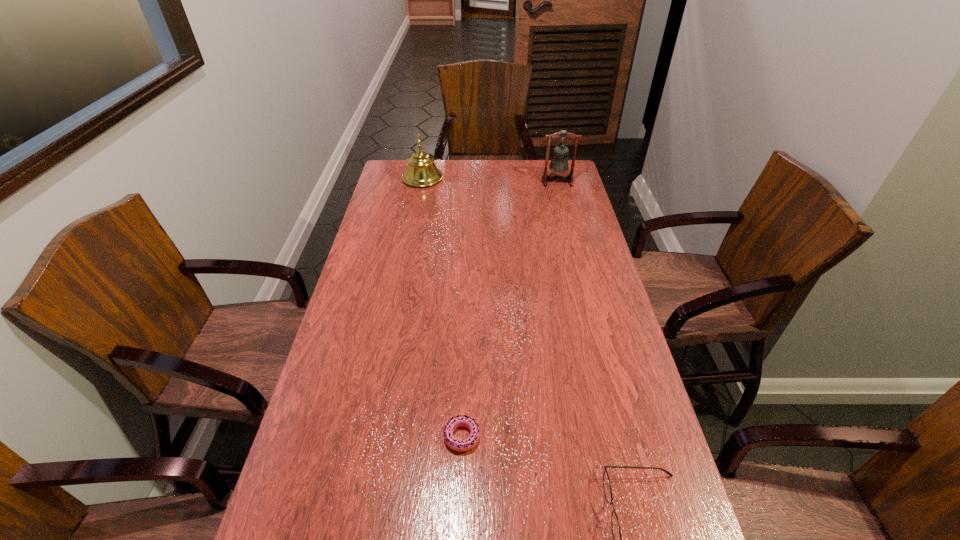
Where is `object present at the far right corner`? The image size is (960, 540). object present at the far right corner is located at coordinates pyautogui.click(x=559, y=163).

Where is `vacant area at the far edge`? Image resolution: width=960 pixels, height=540 pixels. vacant area at the far edge is located at coordinates (490, 176).

I want to click on blank space at the left edge of the desktop, so click(x=390, y=283).

Image resolution: width=960 pixels, height=540 pixels. I want to click on blank space at the right edge of the desktop, so click(x=577, y=213).

Where is `vacant space in between the right bell and the leftmost object`? The image size is (960, 540). vacant space in between the right bell and the leftmost object is located at coordinates (490, 180).

The width and height of the screenshot is (960, 540). Identify the location of unoccupied position between the right bell and the third farthest object. (510, 309).

Locate an element on the screen. vacant area that lies between the doughnut and the right bell is located at coordinates (510, 309).

Identify the location of free space between the right bell and the doughnut. (510, 309).

Identify which object is the third closest to the right bell. Please provide its 2D coordinates. Your answer should be formatted as a tuple, i.e. [(x, y)], where the tuple contains the x and y coordinates of a point satisfying the conditions above.

[(615, 526)]

You are a GUI agent. You are given a task and a screenshot of the screen. Output one action in this format:
    pyautogui.click(x=<x>, y=<y>)
    Task: Click on the object that ranks as the third closest to the right bell
    
    Given the screenshot: What is the action you would take?
    pyautogui.click(x=615, y=526)